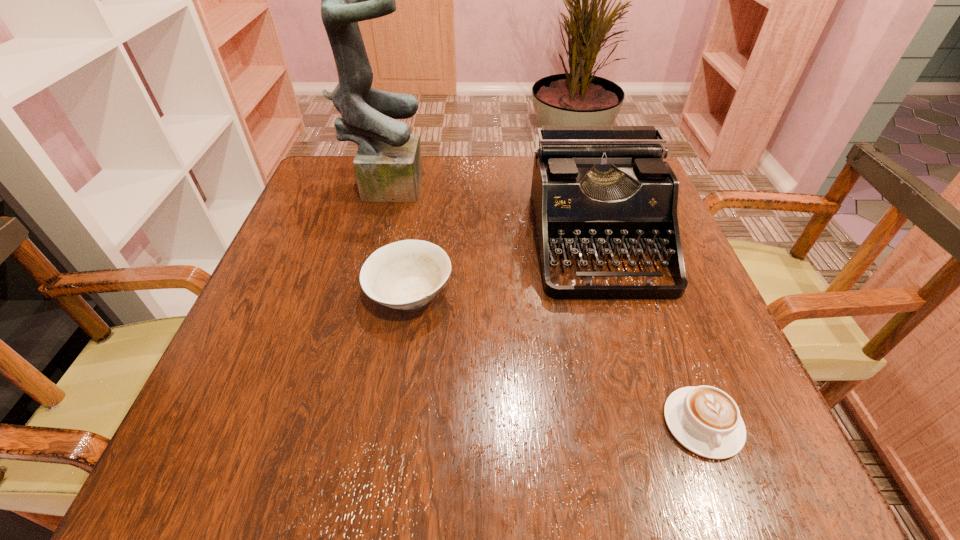
Locate an element on the screen. This screenshot has width=960, height=540. the tallest object is located at coordinates (388, 167).

Where is `the third shortest object`? This screenshot has width=960, height=540. the third shortest object is located at coordinates (594, 188).

Where is `the third tallest object`? The width and height of the screenshot is (960, 540). the third tallest object is located at coordinates (407, 274).

This screenshot has height=540, width=960. What are the coordinates of `cappuccino` in the screenshot? It's located at (705, 420).

Locate an element on the screen. This screenshot has width=960, height=540. the nearest object is located at coordinates (705, 420).

What are the coordinates of `free space located 0.190m on the face of the tallest object` in the screenshot? It's located at (500, 182).

The width and height of the screenshot is (960, 540). What are the coordinates of `vacant position located on the typing side of the second tallest object` in the screenshot? It's located at (648, 420).

Image resolution: width=960 pixels, height=540 pixels. In order to click on vacant region located 0.080m on the right of the bowl in this screenshot , I will do `click(495, 294)`.

This screenshot has height=540, width=960. Identify the location of sculpture that is at the far edge. (388, 167).

Where is `typewriter that is at the far edge`? typewriter that is at the far edge is located at coordinates (594, 188).